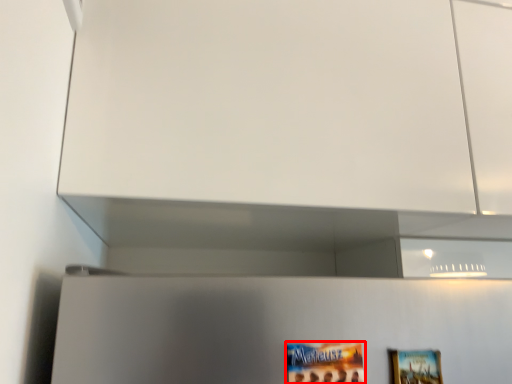
Question: Considering the relative positions of movie poster (annotated by the red box) and picture frame in the image provided, where is movie poster (annotated by the red box) located with respect to the staircase?

Choices:
 (A) right
 (B) left

Answer: (B)